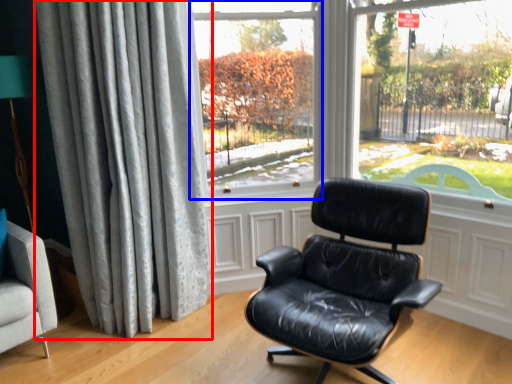
Question: Which object is closer to the camera taking this photo, curtain (highlighted by a red box) or window screen (highlighted by a blue box)?

Choices:
 (A) curtain
 (B) window screen

Answer: (A)